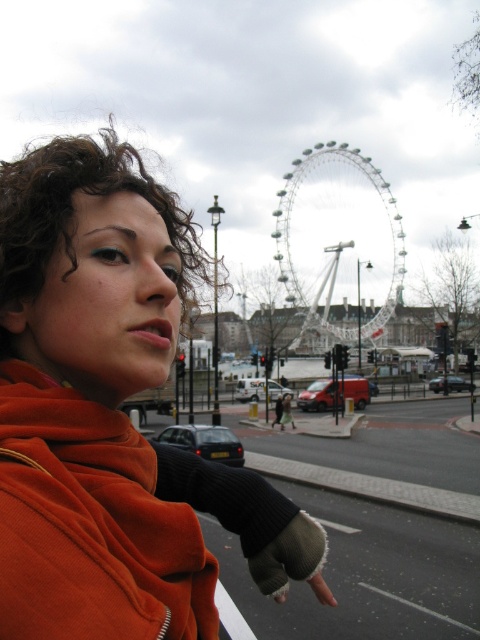
You are a tourist in London and see the orange fleece jacket at center and the white metallic ferris wheel at center. Which object is positioned higher in the image?

The white metallic ferris wheel at center is positioned higher than the orange fleece jacket at center.

You are a tourist in London and see the orange fleece jacket at center and the white metallic ferris wheel at center. Which object is nearer to you?

The orange fleece jacket at center is closer to the viewer than the white metallic ferris wheel at center.